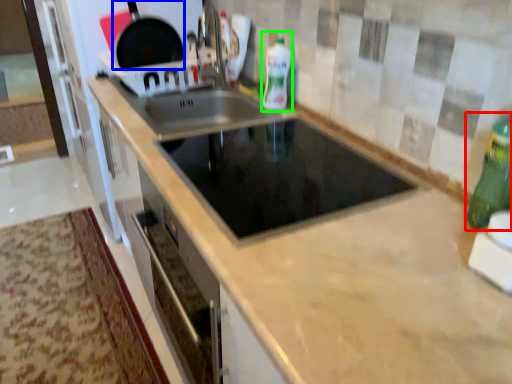
Question: Which object is positioned closest to bottle (highlighted by a red box)? Select from frying pan (highlighted by a blue box) and bottle (highlighted by a green box).

Choices:
 (A) frying pan
 (B) bottle

Answer: (B)